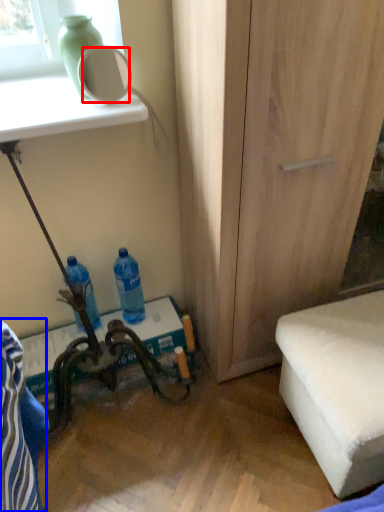
Question: Which object appears farthest to the camera in this image, mirror (highlighted by a red box) or swivel chair (highlighted by a blue box)?

Choices:
 (A) mirror
 (B) swivel chair

Answer: (A)